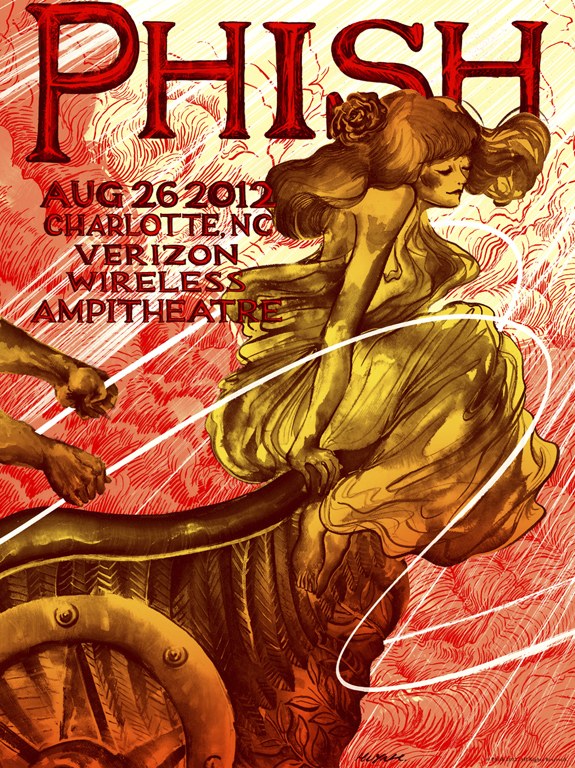
You are a GUI agent. You are given a task and a screenshot of the screen. Output one action in this format:
    pyautogui.click(x=<x>, y=<y>)
    Task: Click on the tour  poster
    The width and height of the screenshot is (575, 768).
    Given the screenshot: What is the action you would take?
    pyautogui.click(x=202, y=371)